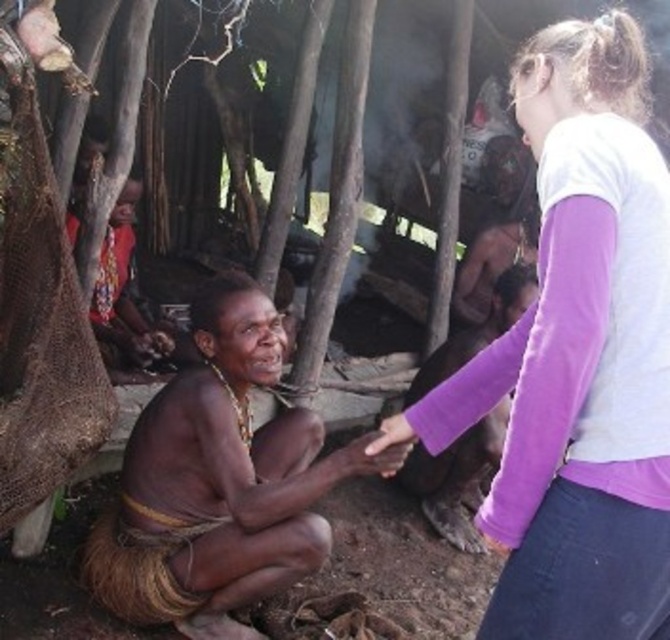
Does white cotton shirt at upper right lie behind brown skin man at center?

No.

This screenshot has width=670, height=640. What do you see at coordinates (578, 356) in the screenshot? I see `white cotton shirt at upper right` at bounding box center [578, 356].

Who is more distant from viewer, (460, 378) or (259, 445)?

The point (259, 445) is more distant.

At what (x,y) coordinates should I click in order to perform the action: click on white cotton shirt at upper right. Please return your answer as a coordinate pair (x, y). The image size is (670, 640). Looking at the image, I should click on (578, 356).